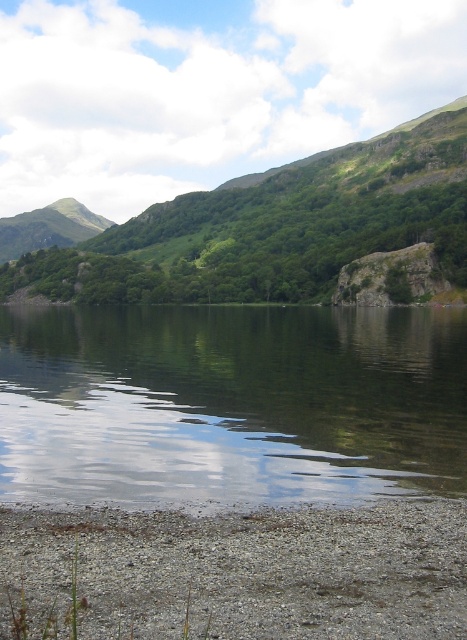
Question: Can you confirm if transparent water at center is thinner than gray gravel at lower left?

Choices:
 (A) no
 (B) yes

Answer: (A)

Question: Among these points, which one is nearest to the camera?

Choices:
 (A) (425, 401)
 (B) (422, 547)

Answer: (B)

Question: Is transparent water at center above gray gravel at lower left?

Choices:
 (A) no
 (B) yes

Answer: (B)

Question: Does transparent water at center appear on the right side of gray gravel at lower left?

Choices:
 (A) no
 (B) yes

Answer: (A)